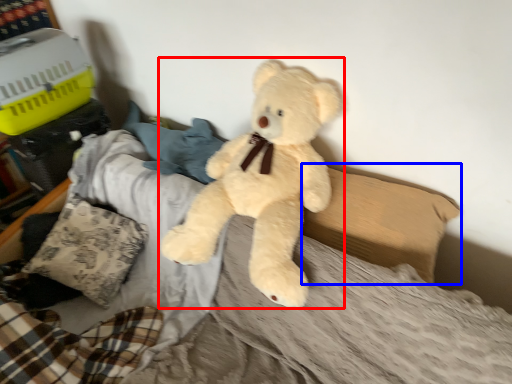
Question: Which point is further to the camera, teddy bear (highlighted by a red box) or pillow (highlighted by a blue box)?

Choices:
 (A) teddy bear
 (B) pillow

Answer: (B)